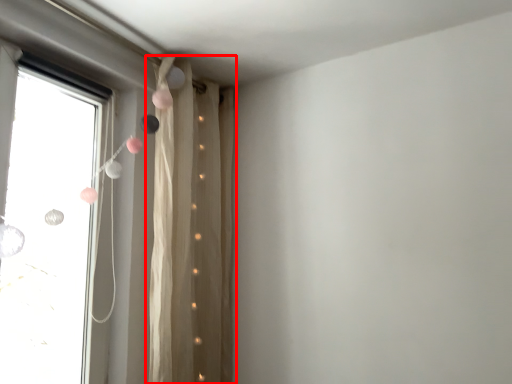
Question: From the image, what is the correct spatial relationship of curtain (annotated by the red box) in relation to window?

Choices:
 (A) right
 (B) left

Answer: (A)